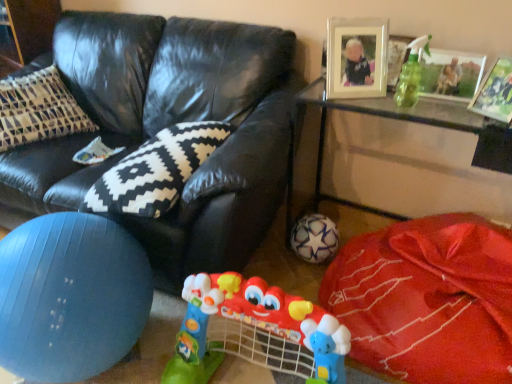
Question: Considering the relative positions of black and white zigzag pillow at center and white textured ball at lower center in the image provided, is black and white zigzag pillow at center to the left or to the right of white textured ball at lower center?

Choices:
 (A) right
 (B) left

Answer: (B)

Question: From their relative heights in the image, would you say black and white zigzag pillow at center is taller or shorter than white textured ball at lower center?

Choices:
 (A) tall
 (B) short

Answer: (B)

Question: Which object is the closest to the white star-patterned ball at lower center?

Choices:
 (A) white textured ball at lower center
 (B) metallic silver picture frame at upper right, which appears as the second picture frame when viewed from the right
 (C) metallic silver picture frame at upper right, positioned as the 3th picture frame in left-to-right order
 (D) blue rubber ball at lower left
 (E) plastic colorful baby walker at center

Answer: (A)

Question: Estimate the real-world distances between objects in this image. Which object is closer to the black and white zigzag pillow at center?

Choices:
 (A) wooden picture frame at upper right, acting as the 3th picture frame starting from the right
 (B) transparent glass table at lower right
 (C) metallic silver picture frame at upper right, positioned as the 3th picture frame in left-to-right order
 (D) white star-patterned ball at lower center
 (E) plastic colorful baby walker at center

Answer: (E)